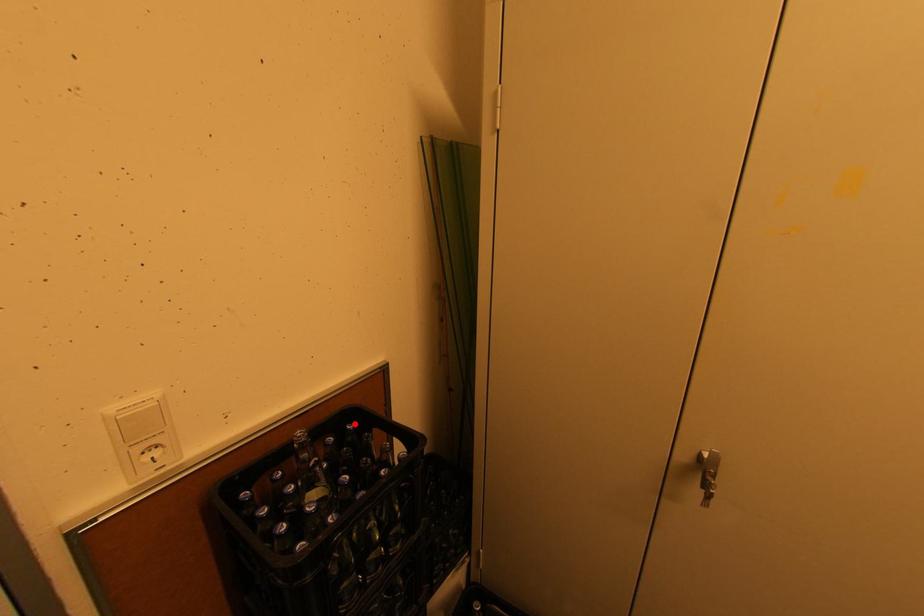
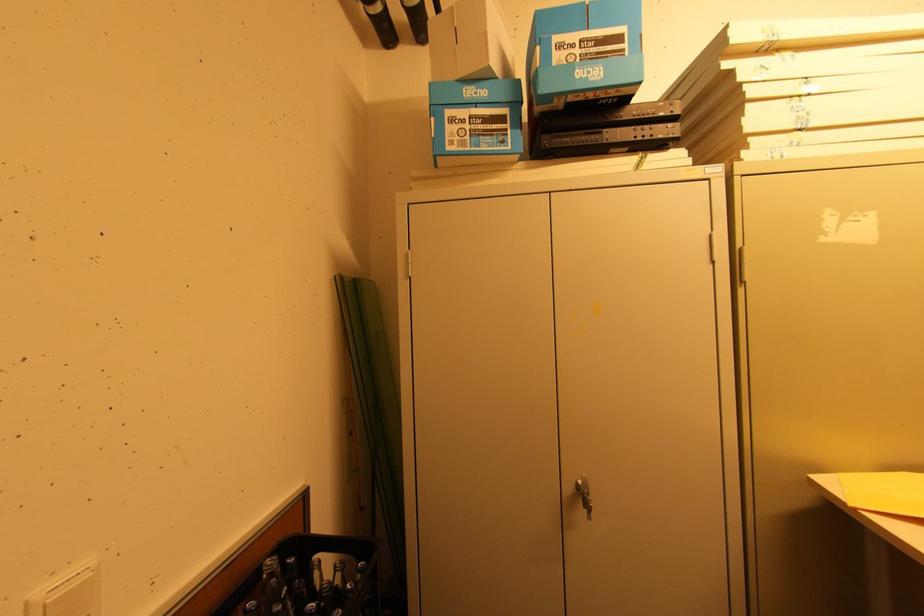
Question: I am providing you with two images of the same scene from different viewpoints. A red point is shown in image1. For the corresponding object point in image2, is it positioned nearer or farther from the camera?

Choices:
 (A) Nearer
 (B) Farther

Answer: (B)